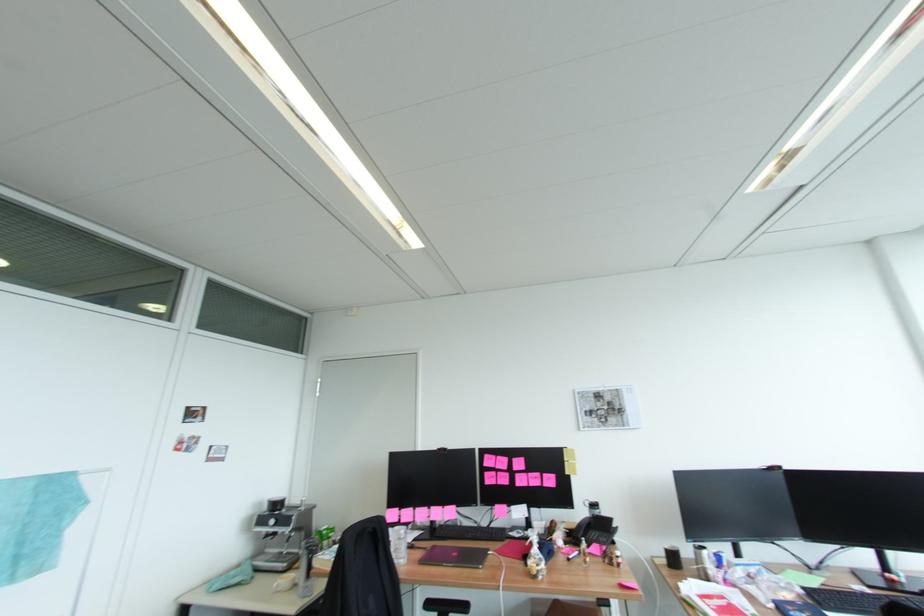
What do you see at coordinates (272, 522) in the screenshot?
I see `the coffee machine knob` at bounding box center [272, 522].